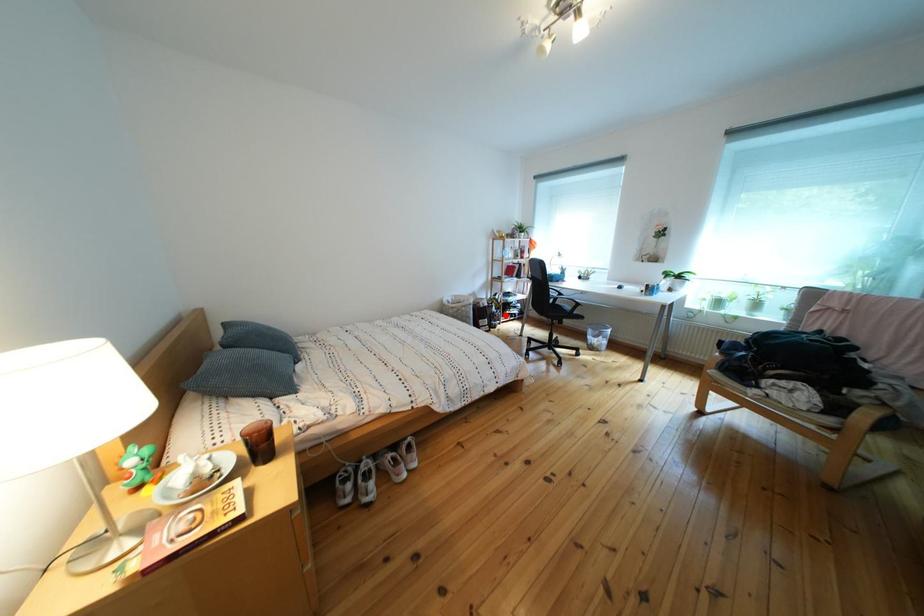
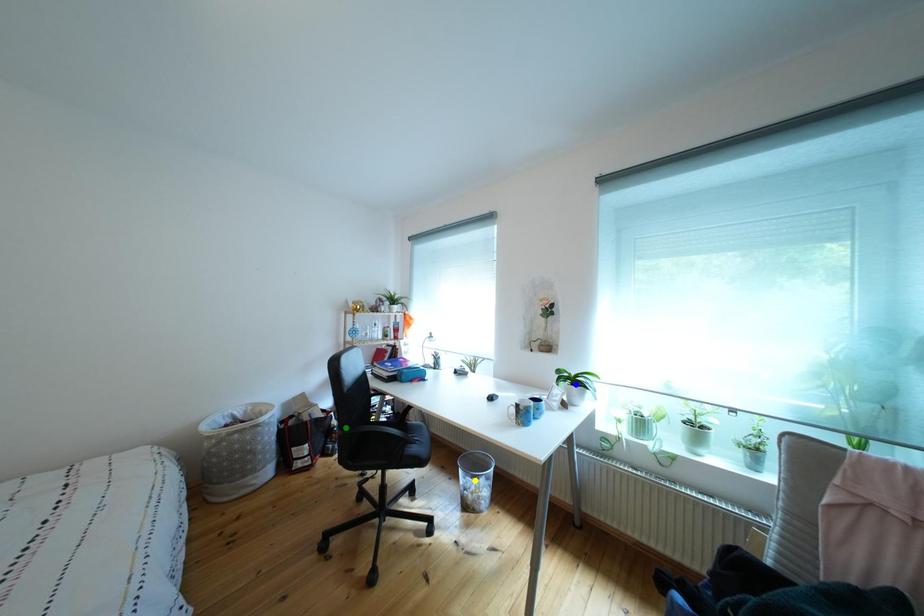
Question: I am providing you with two images of the same scene from different viewpoints. A red point is marked on the first image. You are given multiple points on the second image. Which mark in image 2 goes with the point in image 1?

Choices:
 (A) blue point
 (B) yellow point
 (C) green point

Answer: (C)